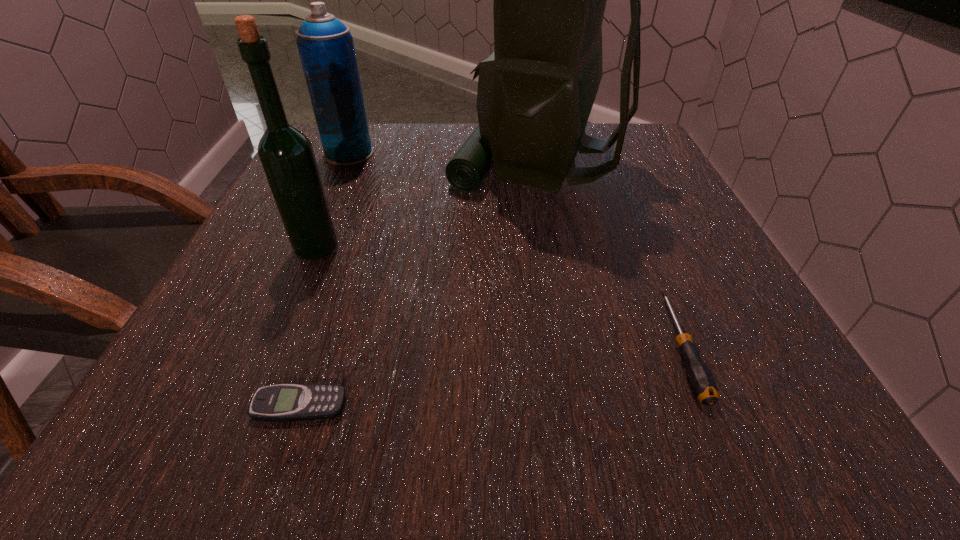
Where is `the tallest object`? This screenshot has width=960, height=540. the tallest object is located at coordinates (535, 93).

You are a GUI agent. You are given a task and a screenshot of the screen. Output one action in this format:
    pyautogui.click(x=<x>, y=<y>)
    Task: Click on the liquor
    
    Given the screenshot: What is the action you would take?
    pyautogui.click(x=287, y=157)

Identify the location of the second tallest object. This screenshot has height=540, width=960. (287, 157).

Image resolution: width=960 pixels, height=540 pixels. In order to click on the third shortest object in this screenshot , I will do `click(325, 45)`.

Identify the location of the fourth tallest object. Image resolution: width=960 pixels, height=540 pixels. (701, 380).

This screenshot has height=540, width=960. Find the location of `the shortest object`. the shortest object is located at coordinates tap(283, 402).

The height and width of the screenshot is (540, 960). I want to click on vacant area situated 0.240m on the front of the backpack with visible pockets, so click(341, 163).

What are the coordinates of `free space located on the front of the backpack with visible pockets` in the screenshot? It's located at coord(391,163).

The width and height of the screenshot is (960, 540). Find the location of `vacant region located 0.060m on the front of the backpack with visible pockets`. vacant region located 0.060m on the front of the backpack with visible pockets is located at coordinates (422, 163).

At what (x,y) coordinates should I click in order to perform the action: click on vacant point located on the front of the fourth shortest object. Please return your answer as a coordinate pair (x, y). This screenshot has height=540, width=960. Looking at the image, I should click on (274, 349).